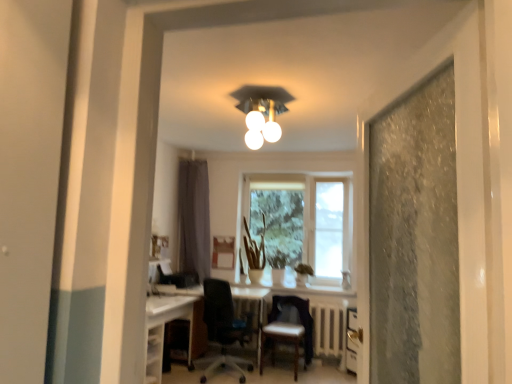
Where is `free spot below leather-like brown chair at center, the first chair positioned from the right (from a real-world perspective)`? Image resolution: width=512 pixels, height=384 pixels. free spot below leather-like brown chair at center, the first chair positioned from the right (from a real-world perspective) is located at coordinates (281, 370).